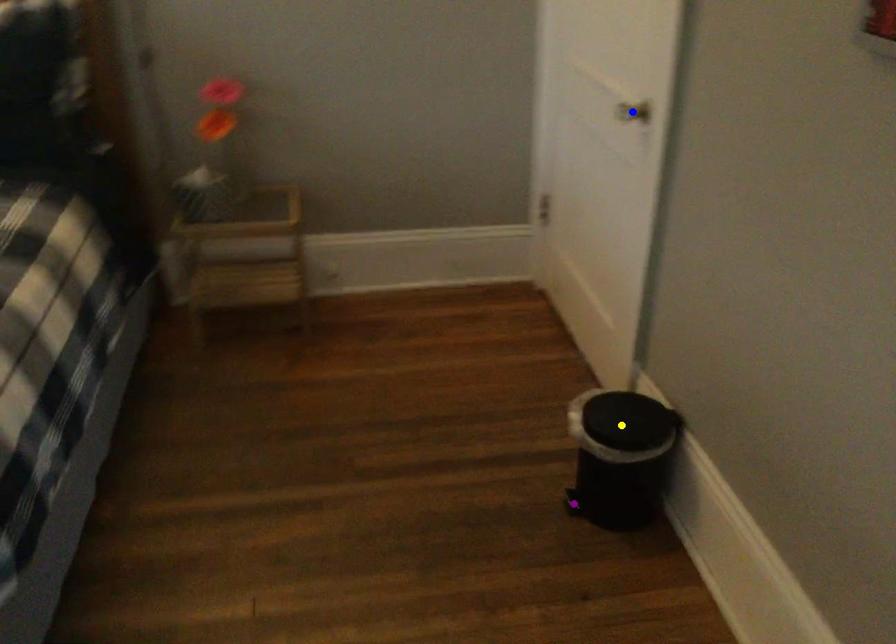
Order these from nearest to farthest:
- blue point
- purple point
- yellow point

yellow point < blue point < purple point